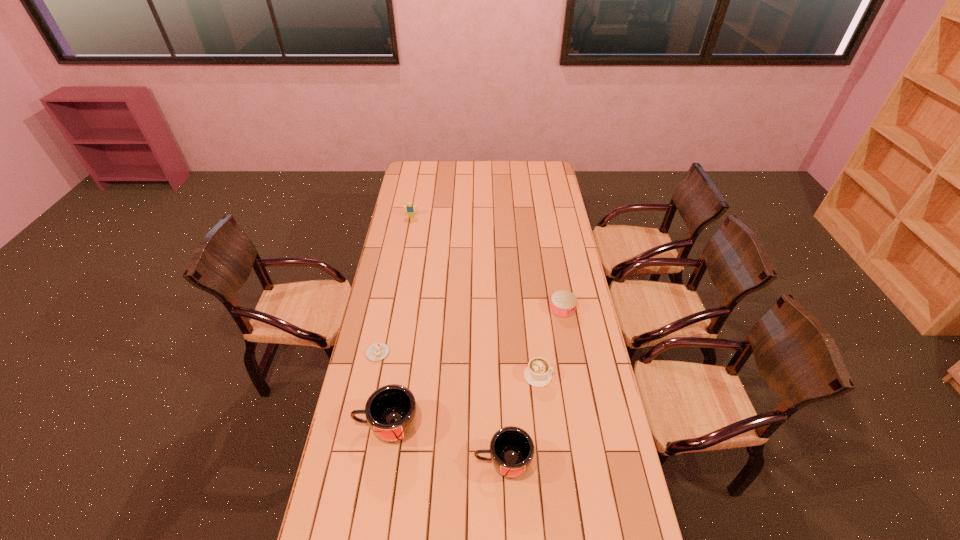
Locate an element on the screen. This screenshot has width=960, height=540. the left mug is located at coordinates click(x=391, y=411).

Locate an element on the screen. Image resolution: width=960 pixels, height=540 pixels. the tallest object is located at coordinates (391, 411).

The width and height of the screenshot is (960, 540). I want to click on the fifth shortest object, so (511, 450).

At what (x,y) coordinates should I click in order to perform the action: click on the shorter mug. Please return your answer as a coordinate pair (x, y). The image size is (960, 540). Looking at the image, I should click on (511, 450).

In order to click on the farthest object in this screenshot , I will do `click(410, 209)`.

Image resolution: width=960 pixels, height=540 pixels. I want to click on the third tallest object, so click(410, 209).

The height and width of the screenshot is (540, 960). Identify the location of cappuccino. pyautogui.click(x=538, y=374).

Locate an element on the screen. the second farthest object is located at coordinates pyautogui.click(x=563, y=303).

The height and width of the screenshot is (540, 960). Find the location of `the rightmost object`. the rightmost object is located at coordinates (563, 303).

This screenshot has height=540, width=960. I want to click on the shortest object, so click(x=377, y=351).